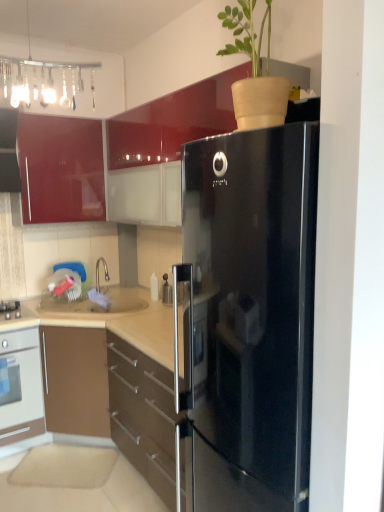
Question: Should I look upward or downward to see glossy red cabinet at upper left, arranged as the second cabinetry when ordered from the bottom?

Choices:
 (A) down
 (B) up

Answer: (B)

Question: Is glossy red cabinet at upper left, which is counted as the first cabinetry, starting from the top, bigger than brown glossy cabinet at lower left, arranged as the second cabinetry when viewed from the top?

Choices:
 (A) yes
 (B) no

Answer: (B)

Question: Considering the relative positions of glossy red cabinet at upper left, arranged as the second cabinetry when ordered from the bottom, and brown glossy cabinet at lower left, the first cabinetry positioned from the bottom, in the image provided, is glossy red cabinet at upper left, arranged as the second cabinetry when ordered from the bottom, behind brown glossy cabinet at lower left, the first cabinetry positioned from the bottom,?

Choices:
 (A) no
 (B) yes

Answer: (B)

Question: Is glossy red cabinet at upper left, which is counted as the first cabinetry, starting from the top, touching brown glossy cabinet at lower left, arranged as the second cabinetry when viewed from the top?

Choices:
 (A) yes
 (B) no

Answer: (B)

Question: Does glossy red cabinet at upper left, arranged as the second cabinetry when ordered from the bottom, have a smaller size compared to brown glossy cabinet at lower left, the first cabinetry positioned from the bottom?

Choices:
 (A) yes
 (B) no

Answer: (A)

Question: Is glossy red cabinet at upper left, arranged as the second cabinetry when ordered from the bottom, positioned in front of brown glossy cabinet at lower left, the first cabinetry positioned from the bottom?

Choices:
 (A) yes
 (B) no

Answer: (B)

Question: Is glossy red cabinet at upper left, which is counted as the first cabinetry, starting from the top, turned away from brown glossy cabinet at lower left, the first cabinetry positioned from the bottom?

Choices:
 (A) yes
 (B) no

Answer: (B)

Question: From the image's perspective, would you say brown glossy cabinet at lower left, the first cabinetry positioned from the bottom, is positioned over glossy red cabinet at upper left, arranged as the second cabinetry when ordered from the bottom?

Choices:
 (A) no
 (B) yes

Answer: (A)

Question: Would you say glossy red cabinet at upper left, arranged as the second cabinetry when ordered from the bottom, is part of brown glossy cabinet at lower left, the first cabinetry positioned from the bottom,'s contents?

Choices:
 (A) no
 (B) yes

Answer: (A)

Question: Considering the relative positions of brown glossy cabinet at lower left, arranged as the second cabinetry when viewed from the top, and glossy red cabinet at upper left, arranged as the second cabinetry when ordered from the bottom, in the image provided, is brown glossy cabinet at lower left, arranged as the second cabinetry when viewed from the top, to the right of glossy red cabinet at upper left, arranged as the second cabinetry when ordered from the bottom, from the viewer's perspective?

Choices:
 (A) no
 (B) yes

Answer: (B)

Question: Are brown glossy cabinet at lower left, arranged as the second cabinetry when viewed from the top, and glossy red cabinet at upper left, which is counted as the first cabinetry, starting from the top, far apart?

Choices:
 (A) yes
 (B) no

Answer: (A)

Question: Considering the relative sizes of brown glossy cabinet at lower left, arranged as the second cabinetry when viewed from the top, and glossy red cabinet at upper left, arranged as the second cabinetry when ordered from the bottom, in the image provided, is brown glossy cabinet at lower left, arranged as the second cabinetry when viewed from the top, wider than glossy red cabinet at upper left, arranged as the second cabinetry when ordered from the bottom,?

Choices:
 (A) no
 (B) yes

Answer: (B)

Question: Is brown glossy cabinet at lower left, the first cabinetry positioned from the bottom, closer to the viewer compared to glossy red cabinet at upper left, arranged as the second cabinetry when ordered from the bottom?

Choices:
 (A) no
 (B) yes

Answer: (B)

Question: Is glossy red cabinet at upper left, arranged as the second cabinetry when ordered from the bottom, at the back of white glossy oven at lower left?

Choices:
 (A) yes
 (B) no

Answer: (B)